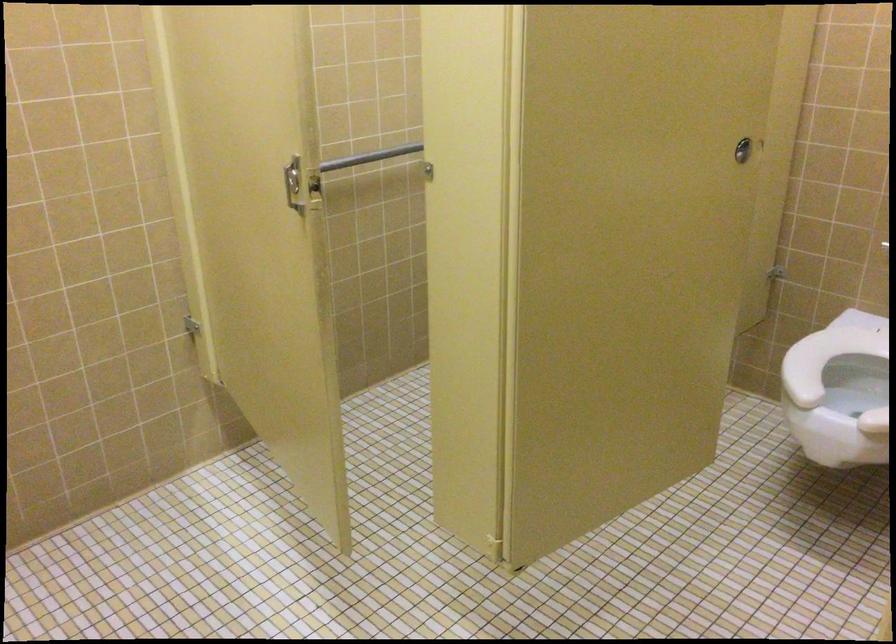
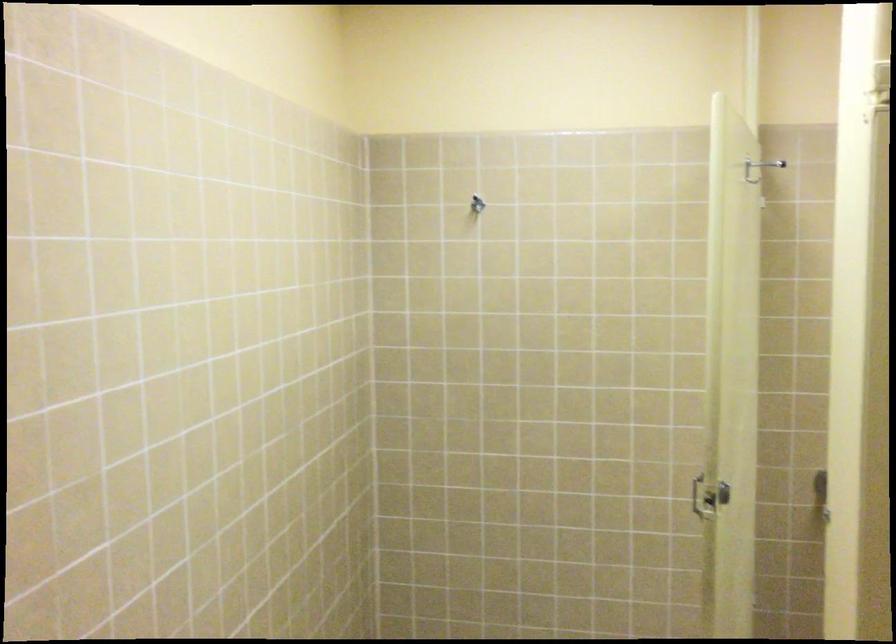
Find the pixel in the second image that matches (311,212) in the first image.

(708, 497)